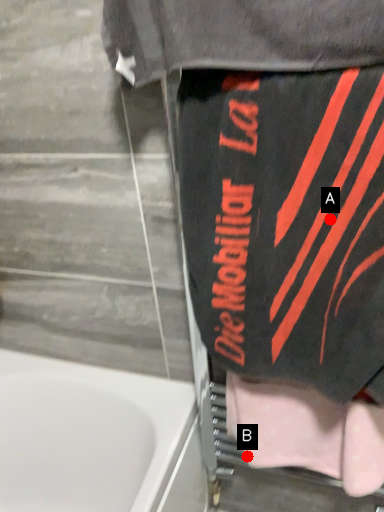
Question: Two points are circled on the image, labeled by A and B beside each circle. Which point is closer to the camera?

Choices:
 (A) A is closer
 (B) B is closer

Answer: (A)